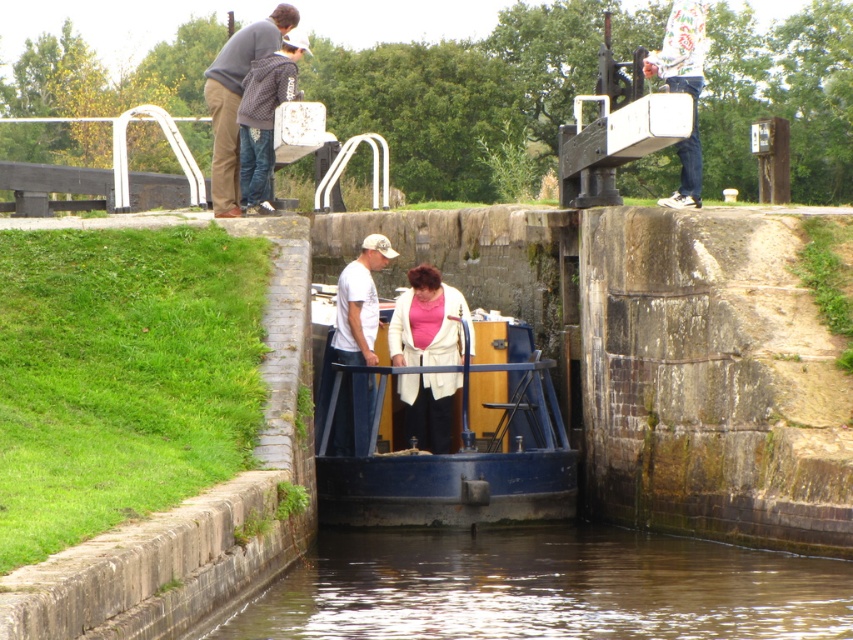
You are standing at the edge of the canal lock and want to take a photo. There are two points of interest marked in the scene. Which point, point (437, 372) or point (375, 234), will appear larger in your photo?

Point (437, 372) will appear larger in the photo because it is closer to the camera than point (375, 234).

What is the color of the object located at point (236, 99) in the canal lock scene?

The object at point (236, 99) is a matte gray sweater at upper left.